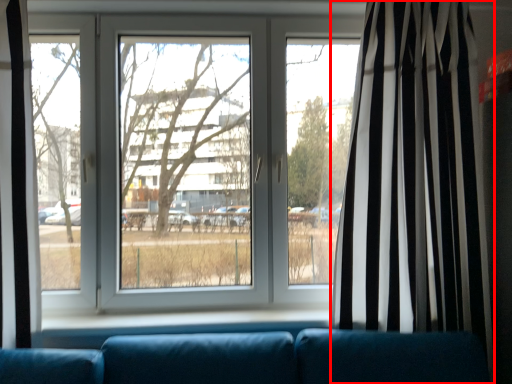
Question: In this image, where is curtain (annotated by the red box) located relative to window?

Choices:
 (A) right
 (B) left

Answer: (A)